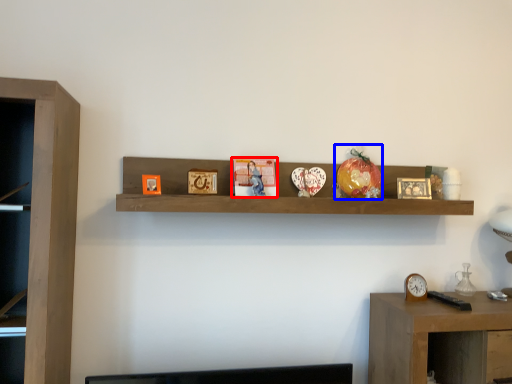
Question: Which object appears farthest to the camera in this image, book (highlighted by a red box) or toy (highlighted by a blue box)?

Choices:
 (A) book
 (B) toy

Answer: (B)